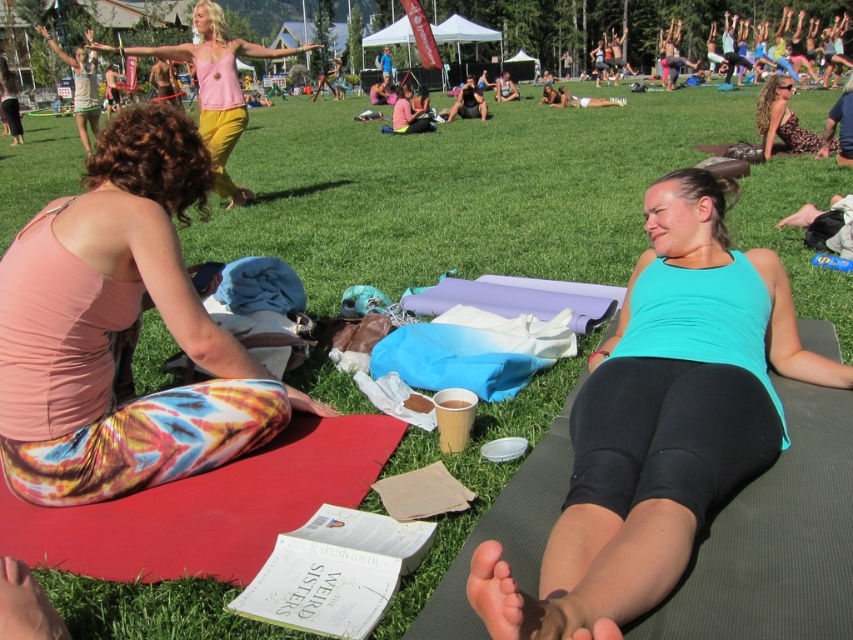
Question: Is matte pink tank top at left thinner than printed floral dress at upper right?

Choices:
 (A) yes
 (B) no

Answer: (A)

Question: Which object is closer to the camera taking this photo?

Choices:
 (A) matte pink tank top at left
 (B) pink matte tank top at upper center

Answer: (A)

Question: Can you confirm if matte pink tank top at left is positioned to the right of pink matte tank top at upper center?

Choices:
 (A) yes
 (B) no

Answer: (A)

Question: Which point appears closest to the camera in this image?

Choices:
 (A) (788, 124)
 (B) (218, 148)

Answer: (B)

Question: Based on their relative distances, which object is farther from the teal fabric tank top at center?

Choices:
 (A) matte pink tank top at left
 (B) pink matte tank top at upper center

Answer: (B)

Question: Observing the image, what is the correct spatial positioning of matte pink tank top at left in reference to teal fabric tank top at center?

Choices:
 (A) left
 (B) right

Answer: (A)